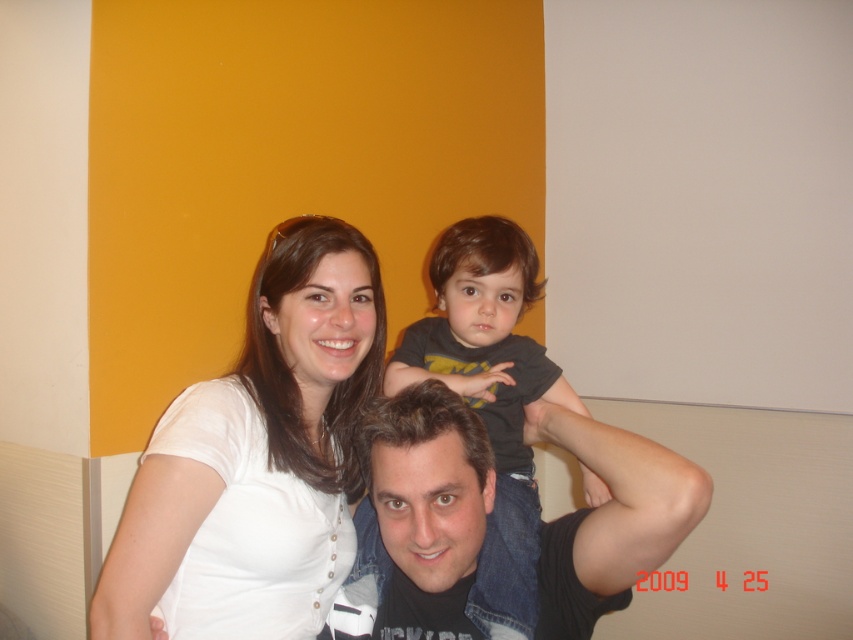
Which is more to the right, black matte shirt at center or dark gray t-shirt at center?

dark gray t-shirt at center is more to the right.

Who is taller, black matte shirt at center or dark gray t-shirt at center?

dark gray t-shirt at center

You are a GUI agent. You are given a task and a screenshot of the screen. Output one action in this format:
    pyautogui.click(x=<x>, y=<y>)
    Task: Click on the black matte shirt at center
    This screenshot has height=640, width=853.
    Given the screenshot: What is the action you would take?
    pyautogui.click(x=427, y=509)

Image resolution: width=853 pixels, height=640 pixels. In order to click on black matte shirt at center in this screenshot , I will do `click(427, 509)`.

Does white matte shirt at upper center appear under white matte shirt at upper left?

No, white matte shirt at upper center is not below white matte shirt at upper left.

Who is more distant from viewer, (450, 561) or (167, 577)?

Positioned behind is point (167, 577).

Locate an element on the screen. This screenshot has width=853, height=640. white matte shirt at upper center is located at coordinates click(x=312, y=346).

Which is behind, point (288, 321) or point (514, 488)?

Positioned behind is point (514, 488).

Does white matte shirt at upper center have a smaller size compared to dark gray t-shirt at center?

Result: No.

Find the location of a particular element. The height and width of the screenshot is (640, 853). white matte shirt at upper center is located at coordinates (312, 346).

Identify the location of white matte shirt at upper center. (312, 346).